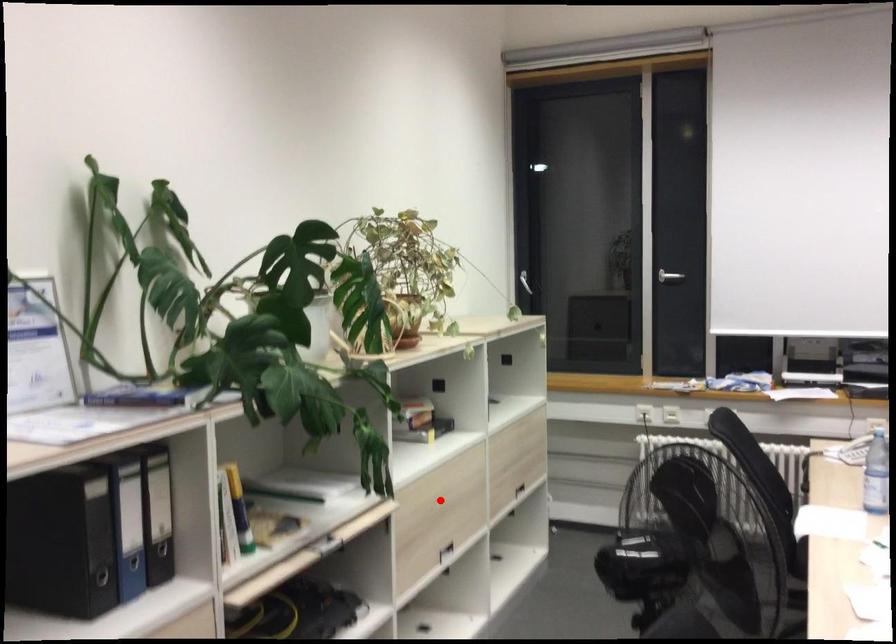
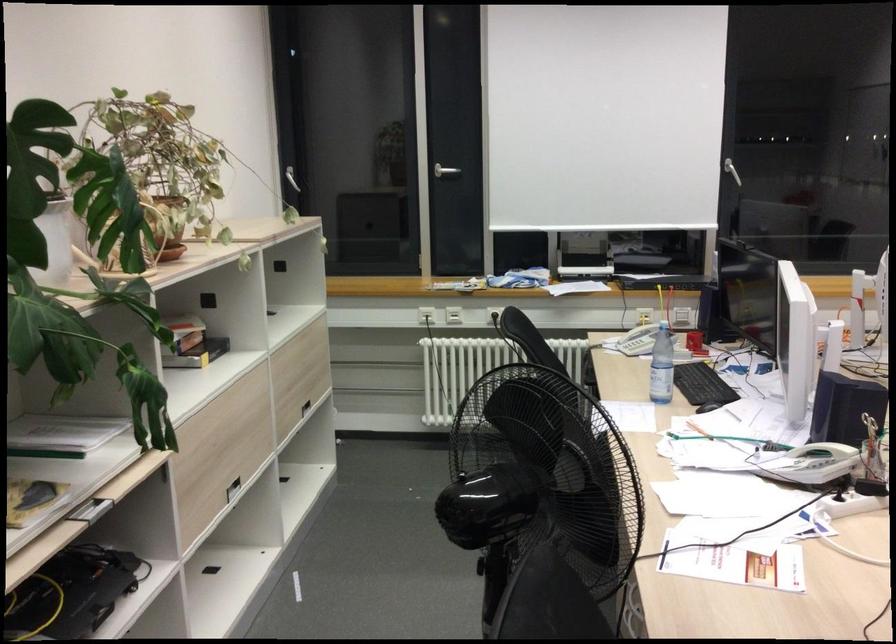
Question: I am providing you with two images of the same scene from different viewpoints. Image1 has a red point marked. In image2, the corresponding 3D location appears at what relative position? Reply with the corresponding letter.

Choices:
 (A) Closer
 (B) Farther

Answer: (A)